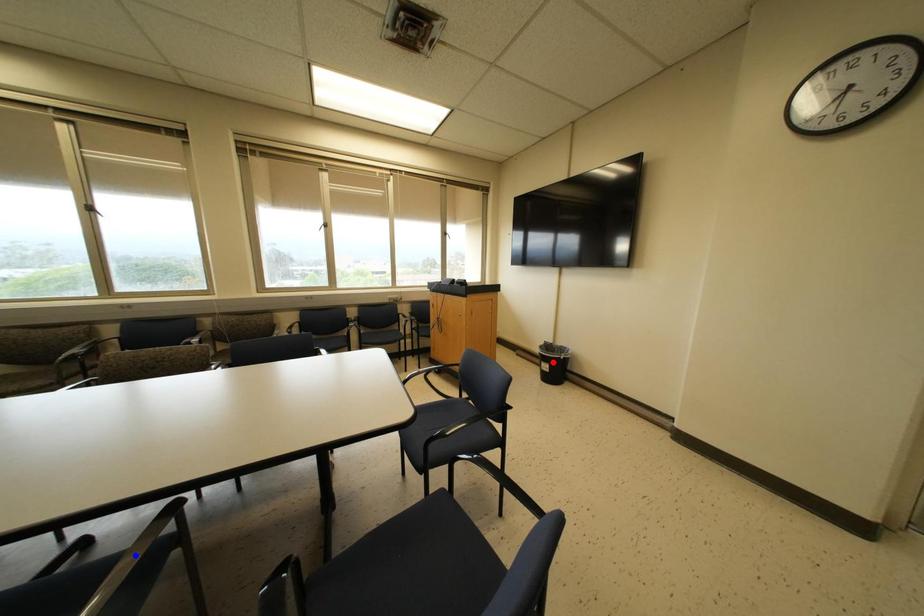
Question: In the image, two points are highlighted. Which point is nearer to the camera? Reply with the corresponding letter.

Choices:
 (A) blue point
 (B) red point

Answer: (A)